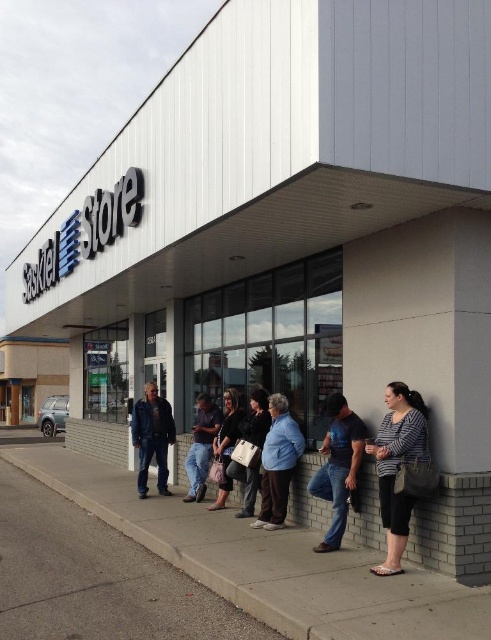
Question: Estimate the real-world distances between objects in this image. Which object is farther from the jeans at center?

Choices:
 (A) striped fabric shirt at lower right
 (B) black leather jacket at center

Answer: (B)

Question: Does striped fabric shirt at lower right have a larger size compared to blue denim jacket at center?

Choices:
 (A) no
 (B) yes

Answer: (B)

Question: Which point is farther to the camera?

Choices:
 (A) (182, 561)
 (B) (384, 496)

Answer: (A)

Question: Is blue cotton shirt at center to the right of black leather jacket at center from the viewer's perspective?

Choices:
 (A) yes
 (B) no

Answer: (A)

Question: Which point appears closest to the camera in this image?

Choices:
 (A) (406, 412)
 (B) (355, 426)

Answer: (A)

Question: Can you confirm if blue denim jacket at center is thinner than denim pants at center?

Choices:
 (A) yes
 (B) no

Answer: (B)